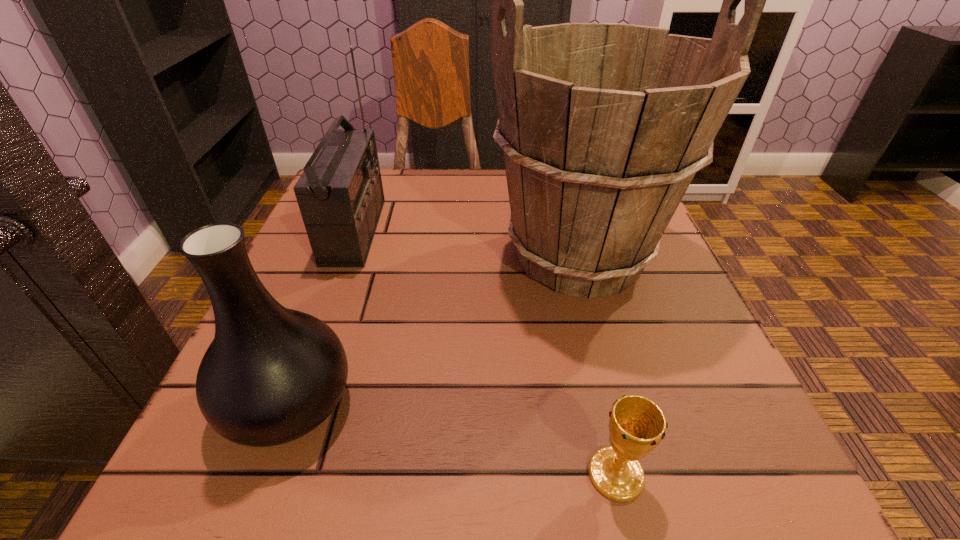
In order to click on vase that is at the near edge in this screenshot , I will do `click(271, 375)`.

At what (x,y) coordinates should I click in order to perform the action: click on chalice positioned at the near edge. Please return your answer as a coordinate pair (x, y). Looking at the image, I should click on (637, 425).

What are the coordinates of `radio receiver present at the left edge` in the screenshot? It's located at (340, 195).

At what (x,y) coordinates should I click in order to perform the action: click on vase that is at the left edge. Please return your answer as a coordinate pair (x, y). This screenshot has height=540, width=960. Looking at the image, I should click on (271, 375).

Identify the location of object at the right edge. The width and height of the screenshot is (960, 540). (603, 126).

I want to click on object that is at the far left corner, so click(x=340, y=195).

Image resolution: width=960 pixels, height=540 pixels. Identify the location of object that is at the near left corner. (271, 375).

At what (x,y) coordinates should I click in order to perform the action: click on object at the far right corner. Please return your answer as a coordinate pair (x, y). Looking at the image, I should click on (603, 126).

This screenshot has width=960, height=540. I want to click on vacant space at the far edge of the desktop, so click(444, 169).

The width and height of the screenshot is (960, 540). In order to click on vacant space at the near edge of the desktop in this screenshot , I will do `click(465, 455)`.